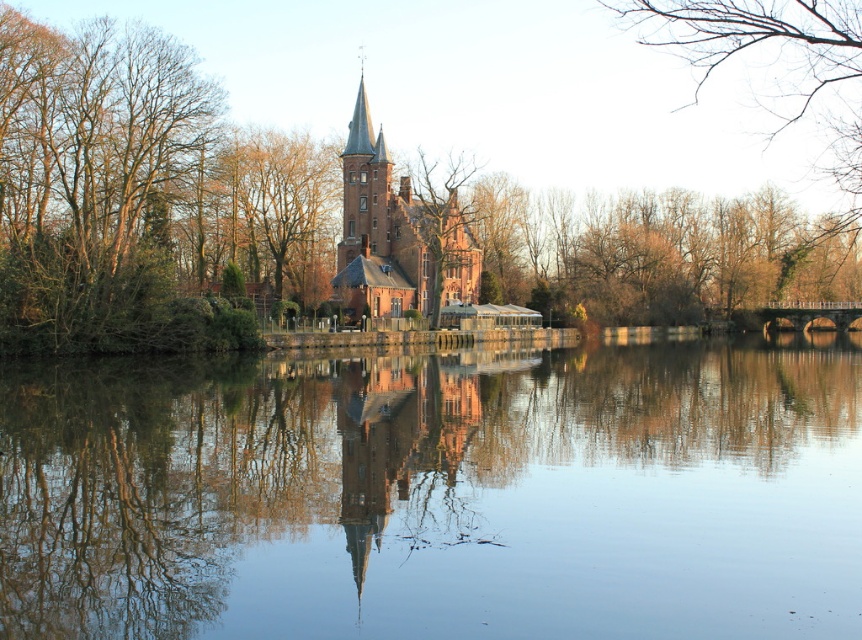
Who is lower down, smooth water at center or brick tower at center?

smooth water at center is lower down.

Does smooth water at center have a greater height compared to brick tower at center?

Incorrect, smooth water at center's height is not larger of brick tower at center's.

Where is `smooth water at center`? smooth water at center is located at coordinates (436, 493).

Describe the element at coordinates (436, 493) in the screenshot. The height and width of the screenshot is (640, 862). I see `smooth water at center` at that location.

Who is shorter, smooth water at center or brown leafless tree at left?

smooth water at center

This screenshot has height=640, width=862. In order to click on smooth water at center in this screenshot , I will do `click(436, 493)`.

Is brown leafless tree at left positioned at the back of brick tower at center?

That is False.

Which is more to the left, brown leafless tree at left or brick tower at center?

brown leafless tree at left is more to the left.

Where is `brown leafless tree at left`? This screenshot has height=640, width=862. brown leafless tree at left is located at coordinates (94, 184).

What are the coordinates of `brown leafless tree at left` in the screenshot? It's located at (94, 184).